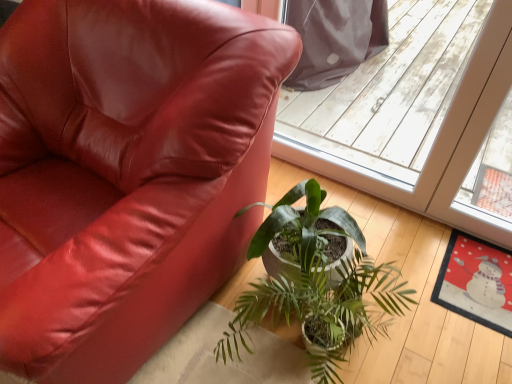
Question: Should I look upward or downward to see transparent plastic screen door at upper center?

Choices:
 (A) up
 (B) down

Answer: (A)

Question: From the image's perspective, is matte leather chair at lower left under transparent plastic screen door at upper center?

Choices:
 (A) yes
 (B) no

Answer: (A)

Question: Considering the relative sizes of matte leather chair at lower left and transparent plastic screen door at upper center in the image provided, is matte leather chair at lower left thinner than transparent plastic screen door at upper center?

Choices:
 (A) yes
 (B) no

Answer: (B)

Question: Is matte leather chair at lower left next to transparent plastic screen door at upper center?

Choices:
 (A) no
 (B) yes

Answer: (A)

Question: Is matte leather chair at lower left closer to the viewer compared to transparent plastic screen door at upper center?

Choices:
 (A) no
 (B) yes

Answer: (B)

Question: Can you confirm if matte leather chair at lower left is positioned to the right of transparent plastic screen door at upper center?

Choices:
 (A) yes
 (B) no

Answer: (B)

Question: From the image's perspective, is matte leather chair at lower left located above transparent plastic screen door at upper center?

Choices:
 (A) yes
 (B) no

Answer: (B)

Question: From the image's perspective, is transparent plastic screen door at upper center over matte leather chair at lower left?

Choices:
 (A) no
 (B) yes

Answer: (B)

Question: Can you confirm if transparent plastic screen door at upper center is smaller than matte leather chair at lower left?

Choices:
 (A) yes
 (B) no

Answer: (A)

Question: Can you confirm if transparent plastic screen door at upper center is bigger than matte leather chair at lower left?

Choices:
 (A) no
 (B) yes

Answer: (A)

Question: Is matte leather chair at lower left at the back of transparent plastic screen door at upper center?

Choices:
 (A) no
 (B) yes

Answer: (A)

Question: Is transparent plastic screen door at upper center shorter than matte leather chair at lower left?

Choices:
 (A) yes
 (B) no

Answer: (B)

Question: Does transparent plastic screen door at upper center have a greater height compared to matte leather chair at lower left?

Choices:
 (A) no
 (B) yes

Answer: (B)

Question: Is green glossy plant at center placed right next to matte leather chair at lower left?

Choices:
 (A) yes
 (B) no

Answer: (B)